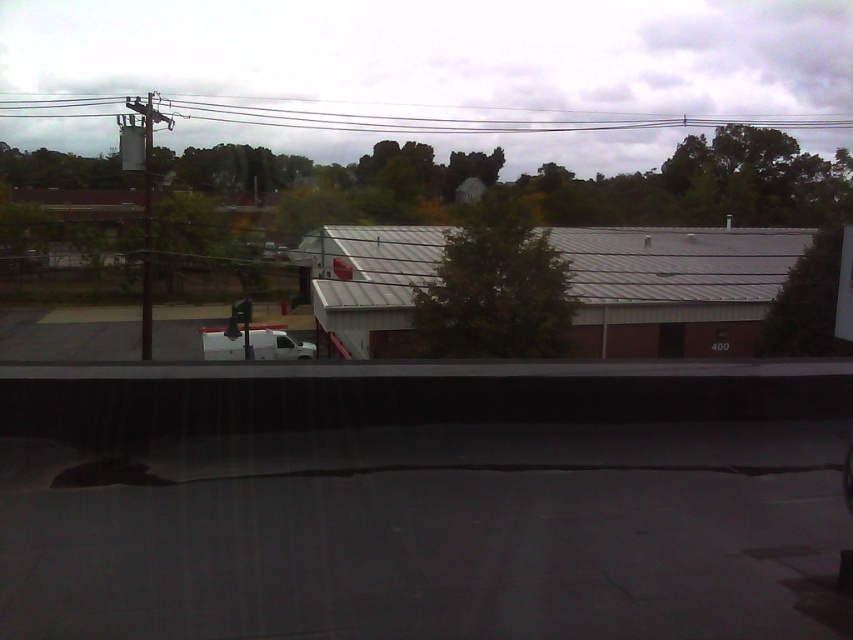
Question: Which object is farther from the camera taking this photo?

Choices:
 (A) green leafy tree at right
 (B) metallic gray shed at center

Answer: (B)

Question: Can you confirm if green leafy tree at center is positioned above white matte van at center?

Choices:
 (A) yes
 (B) no

Answer: (A)

Question: Does metallic gray shed at center have a smaller size compared to green leafy tree at right?

Choices:
 (A) no
 (B) yes

Answer: (A)

Question: Which of the following is the farthest from the observer?

Choices:
 (A) (753, 118)
 (B) (811, 312)
 (C) (465, 244)

Answer: (A)

Question: Can you confirm if metallic gray shed at center is positioned above white matte van at center?

Choices:
 (A) no
 (B) yes

Answer: (B)

Question: Which object is the closest to the green leafy tree at center?

Choices:
 (A) metallic gray shed at center
 (B) black wire at upper center
 (C) white matte van at center
 (D) green leafy tree at right

Answer: (D)